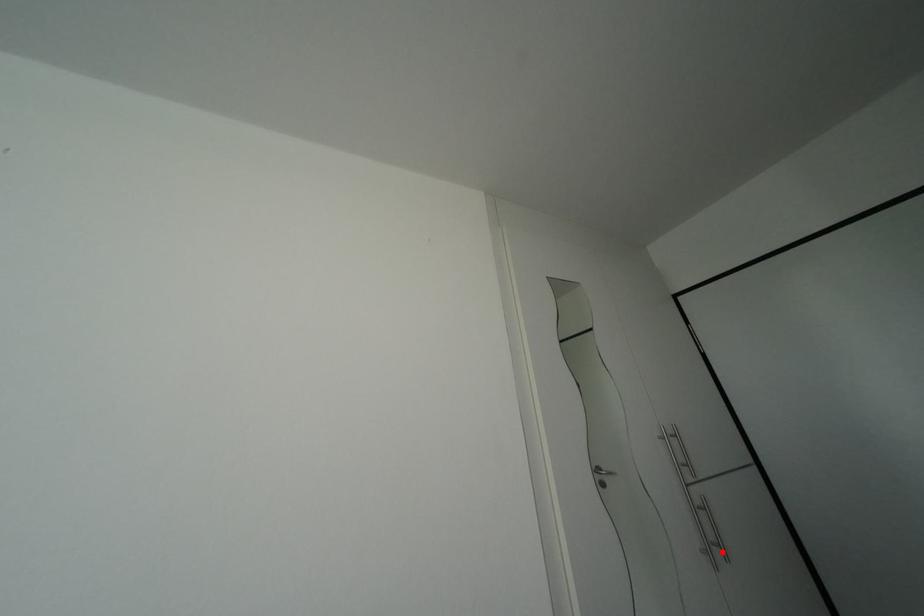
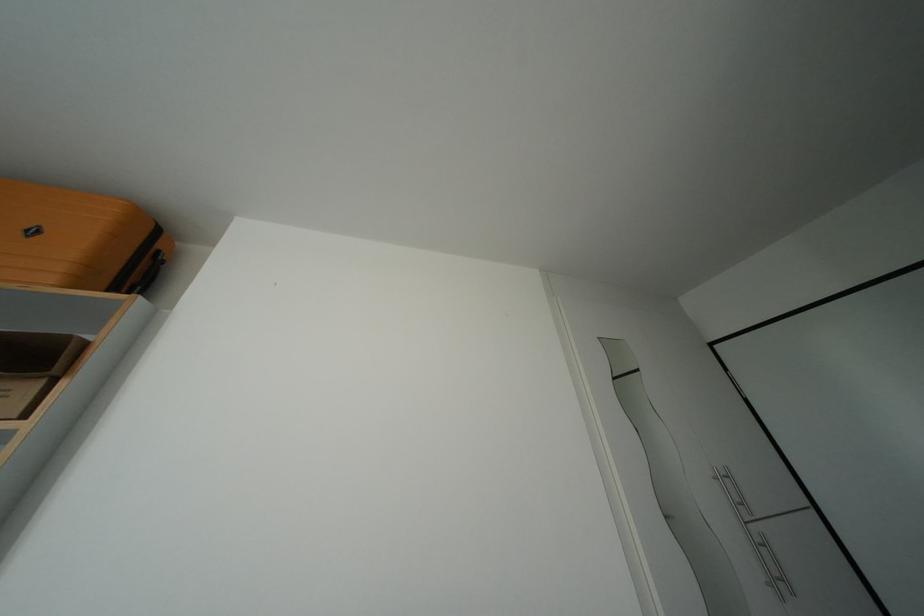
Find the pixel in the second image that matches the highlighted location in the first image.

(787, 586)